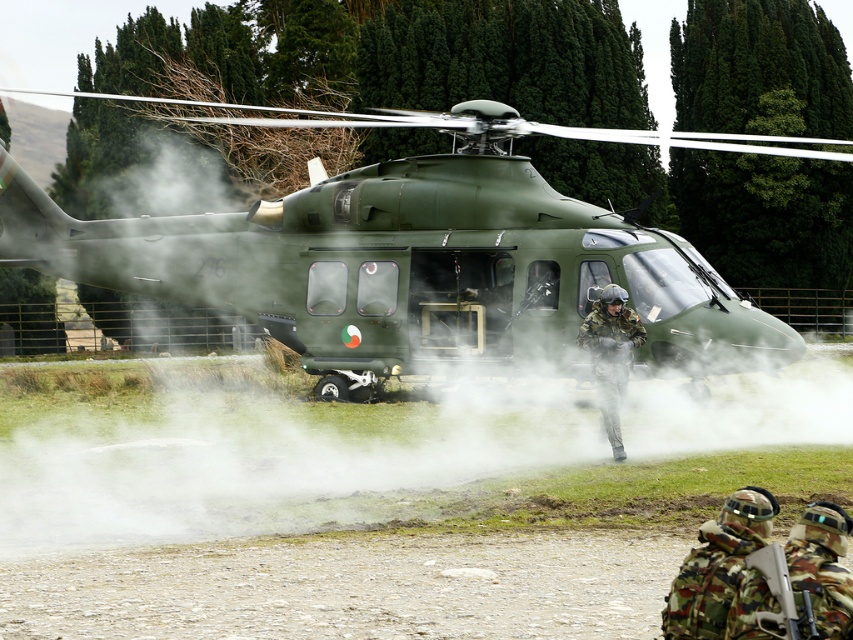
Can you confirm if matte green helicopter at center is bigger than camouflage fabric helmet at center?

Yes, matte green helicopter at center is bigger than camouflage fabric helmet at center.

Between point (567, 230) and point (618, 305), which one is positioned behind?

The point (567, 230) is behind.

Is point (24, 230) positioned behind point (608, 403)?

That is True.

Where is `matte green helicopter at center`? matte green helicopter at center is located at coordinates (408, 257).